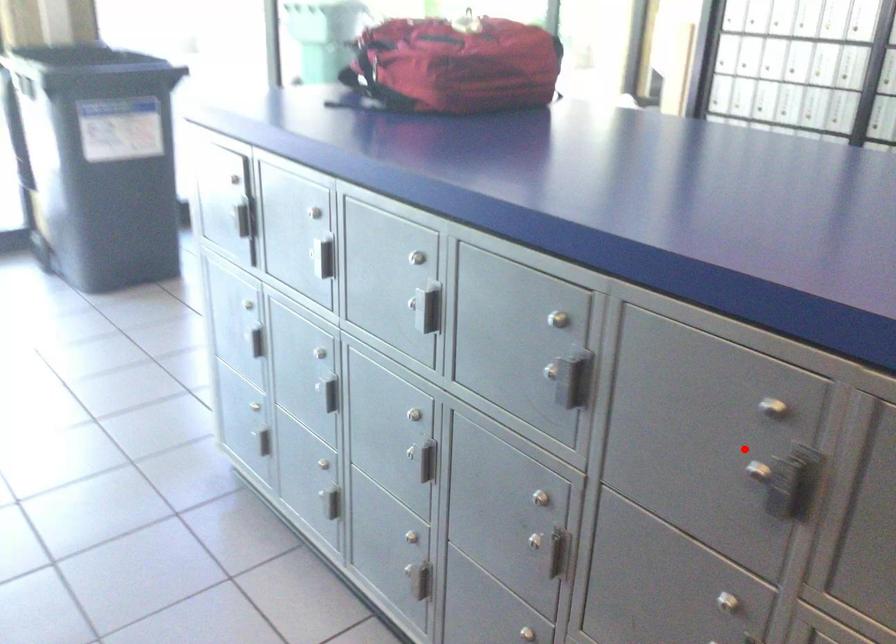
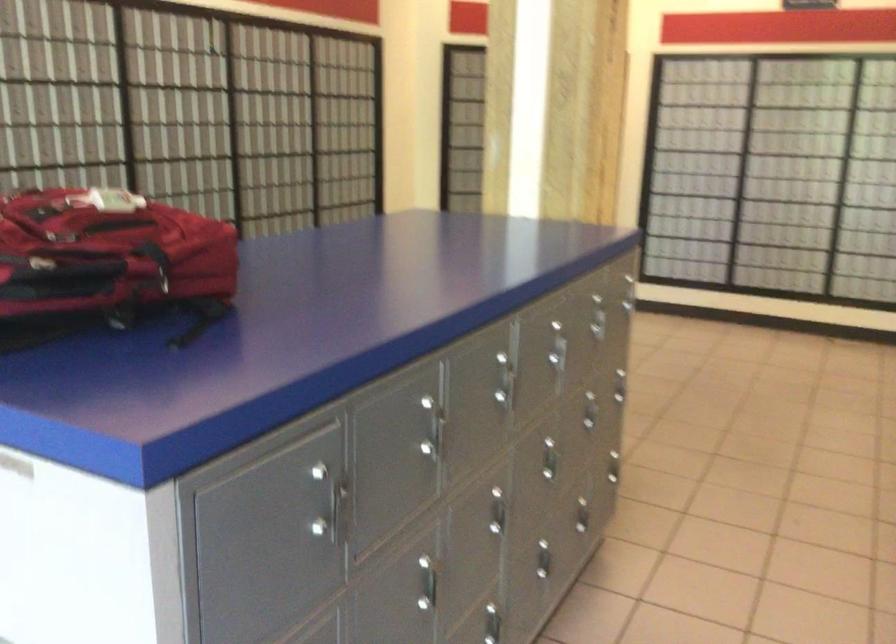
Find the pixel in the second image that matches the highlighted location in the first image.

(601, 317)